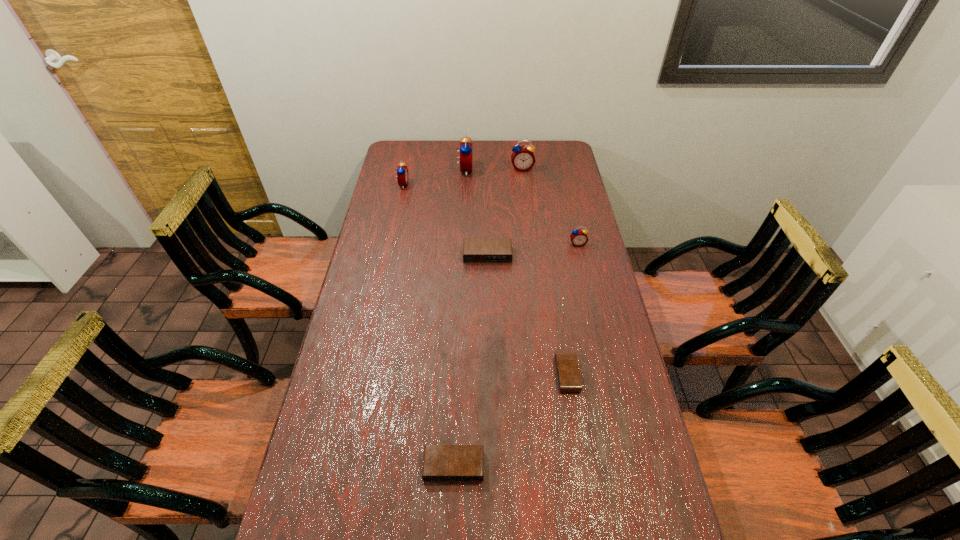
Where is `the tallest object`? The width and height of the screenshot is (960, 540). the tallest object is located at coordinates (465, 149).

At what (x,y) coordinates should I click in order to perform the action: click on the second red alarm clock from left to right. Please return your answer as a coordinate pair (x, y). Looking at the image, I should click on (465, 149).

Where is `the third red alarm clock from left to right`? Image resolution: width=960 pixels, height=540 pixels. the third red alarm clock from left to right is located at coordinates (523, 158).

Where is `the second biggest red alarm clock`? The image size is (960, 540). the second biggest red alarm clock is located at coordinates (523, 158).

Find the location of `the leftmost alarm clock`. the leftmost alarm clock is located at coordinates (402, 171).

The height and width of the screenshot is (540, 960). I want to click on the fifth shortest alarm clock, so click(402, 171).

Find the location of a particular element. the fourth tallest object is located at coordinates (579, 237).

Find the location of a particular element. the rightmost alarm clock is located at coordinates (579, 237).

You are a GUI agent. You are given a task and a screenshot of the screen. Output one action in this format:
    pyautogui.click(x=<x>, y=<y>)
    Task: Click on the biggest black alarm clock
    The image size is (960, 540).
    Given the screenshot: What is the action you would take?
    pyautogui.click(x=475, y=250)

The width and height of the screenshot is (960, 540). What are the coordinates of `the farthest black alarm clock` in the screenshot? It's located at (475, 250).